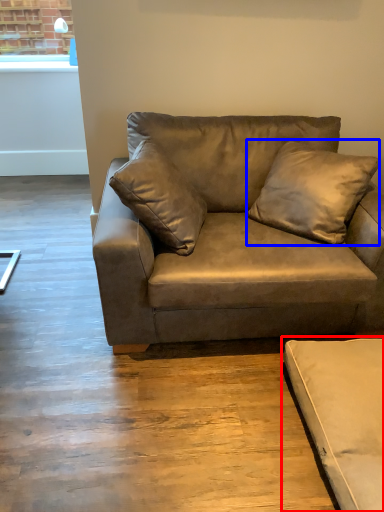
Question: Which of the following is the farthest to the observer, studio couch (highlighted by a red box) or pillow (highlighted by a blue box)?

Choices:
 (A) studio couch
 (B) pillow

Answer: (B)